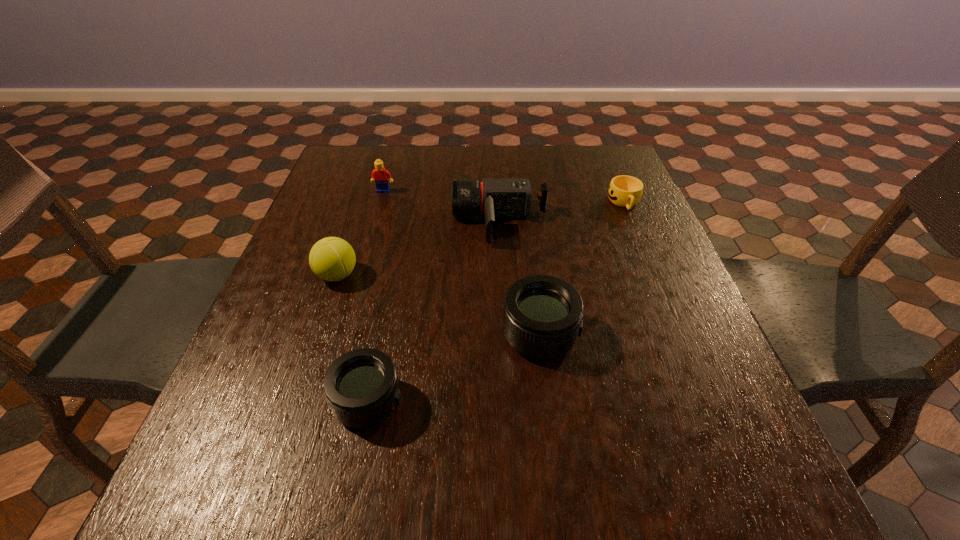
Where is `vacant area that lies between the tennis ball and the camcorder`? The image size is (960, 540). vacant area that lies between the tennis ball and the camcorder is located at coordinates (419, 248).

I want to click on empty space between the camcorder and the Lego, so click(x=442, y=206).

The image size is (960, 540). Identify the location of free area in between the Lego and the farther telephoto lens. (462, 262).

Where is `empty space that is in between the camcorder and the Lego`? The image size is (960, 540). empty space that is in between the camcorder and the Lego is located at coordinates (442, 206).

Where is `blank region between the camcorder and the third nearest object`? This screenshot has height=540, width=960. blank region between the camcorder and the third nearest object is located at coordinates (419, 248).

Identify the location of vacant space that is in between the camcorder and the taller telephoto lens. (520, 278).

Where is `free space between the Lego and the tennis ball`? The image size is (960, 540). free space between the Lego and the tennis ball is located at coordinates (360, 233).

Locate an element on the screen. This screenshot has width=960, height=540. empty space that is in between the cup and the fourth farthest object is located at coordinates (481, 239).

Locate an element on the screen. The image size is (960, 540). object that stands as the third closest to the camcorder is located at coordinates (542, 319).

Locate an element on the screen. object that is the fifth closest to the fourth farthest object is located at coordinates (624, 191).